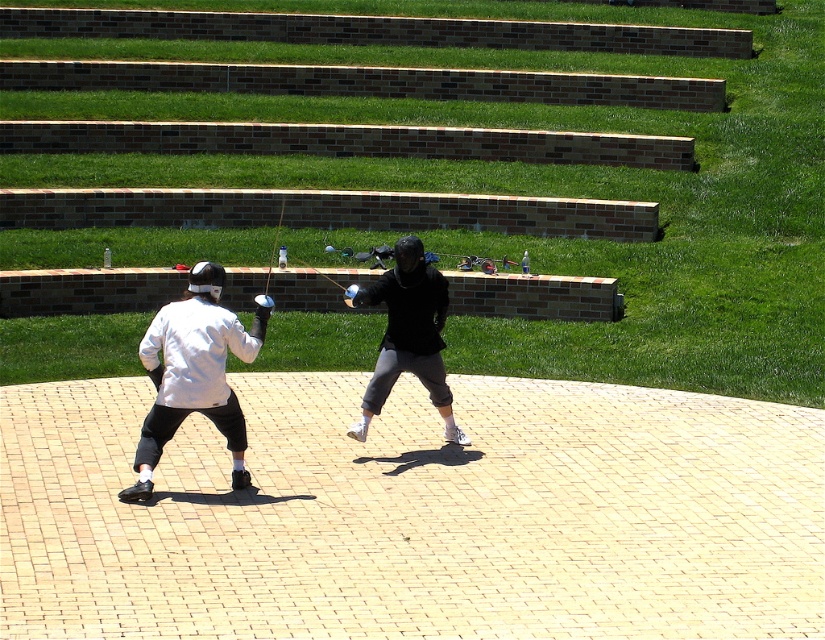
Question: Which point is closer to the camera?

Choices:
 (A) black matte jacket at center
 (B) white matte jacket at center
 (C) white matte fencing gear at center

Answer: (B)

Question: Among these points, which one is nearest to the camera?

Choices:
 (A) (394, 371)
 (B) (182, 376)
 (C) (158, 419)

Answer: (B)

Question: Which of the following is the farthest from the observer?

Choices:
 (A) tap(151, 451)
 (B) tap(180, 356)

Answer: (A)

Question: Is white matte fencing gear at center to the left of black matte jacket at center from the viewer's perspective?

Choices:
 (A) yes
 (B) no

Answer: (A)

Question: Does white matte fencing gear at center lie in front of white matte jacket at center?

Choices:
 (A) yes
 (B) no

Answer: (B)

Question: Is white matte fencing gear at center below black matte jacket at center?

Choices:
 (A) yes
 (B) no

Answer: (A)